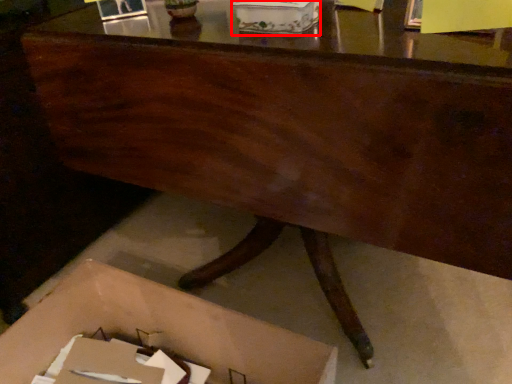
Question: From the image's perspective, what is the correct spatial relationship of storage box (annotated by the red box) in relation to storage box?

Choices:
 (A) above
 (B) below

Answer: (A)